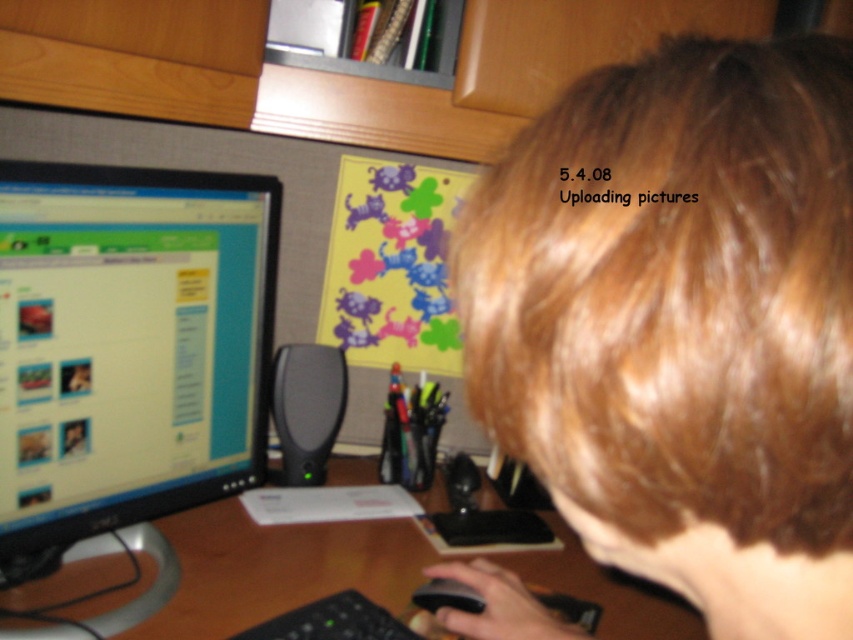
You are a photographer organizing your images on the computer. You see the brown hair at upper right and the black plastic mouse at lower center on your desk. Which object is closer to the top edge of the desk?

The brown hair at upper right is closer to the top edge of the desk because it is positioned over the black plastic mouse at lower center.

You have a ruler that measures in inches. You need to place a 7.5 inch long object between the wooden at center and the black plastic keyboard at lower center. Will it fit?

The distance between the wooden at center and the black plastic keyboard at lower center is 7.60 inches. Since the object is 7.5 inches long, it will fit with a small amount of space remaining.

What object is located at the coordinates point (682, 323)?

The point (682, 323) corresponds to the brown hair at upper right.